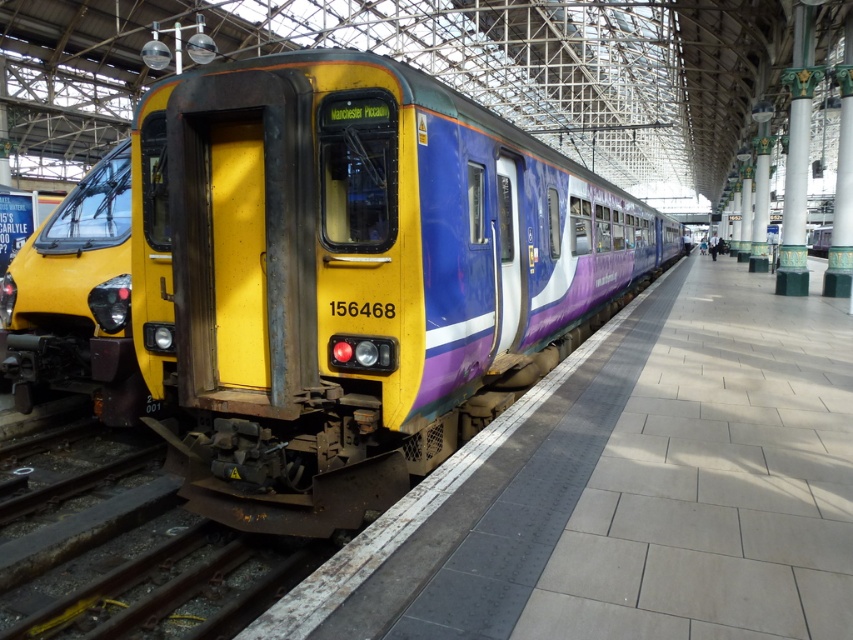
Question: Is metal at center bigger than yellow matte train at left?

Choices:
 (A) no
 (B) yes

Answer: (A)

Question: Among these points, which one is nearest to the camera?

Choices:
 (A) (93, 176)
 (B) (258, 592)

Answer: (B)

Question: Which of the following is the farthest from the observer?

Choices:
 (A) yellow matte train at left
 (B) metal at center

Answer: (A)

Question: Does metal at center have a smaller size compared to yellow matte train at left?

Choices:
 (A) no
 (B) yes

Answer: (B)

Question: Is metal at center below yellow matte train at left?

Choices:
 (A) no
 (B) yes

Answer: (B)